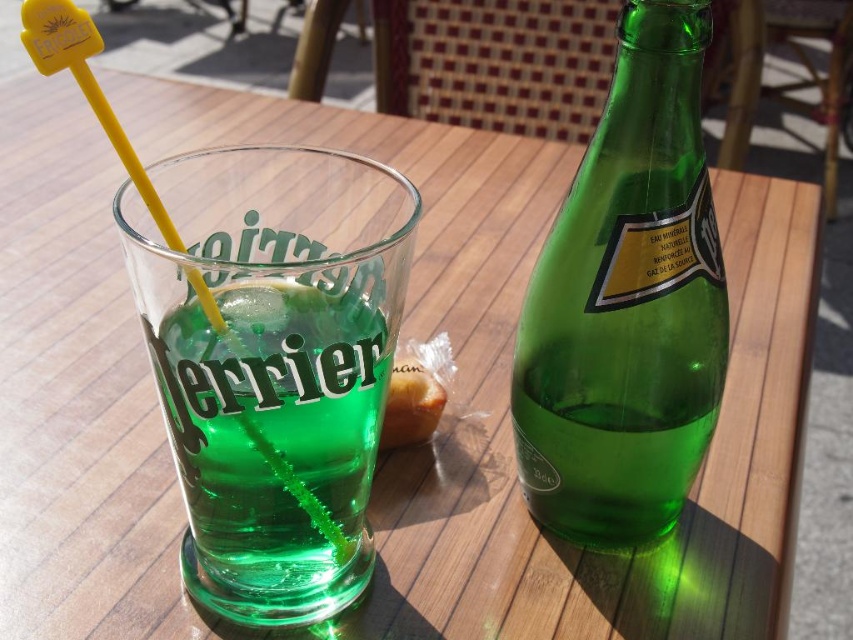
Consider the image. You are at a Perrier table with both the green glass bottle at right and the green glass at center. If you want to pour water from the bottle into the glass, will the glass be able to hold all the water from the bottle?

The green glass bottle at right has a larger size compared to green glass at center, so the glass might not hold all the water from the bottle since the bottle can contain more liquid.

You are sitting at the wooden table in the image. You want to reach for the bread at center without knocking over the green glass at center. Based on their positions, which object should you move first?

The green glass at center is in front of the bread at center, so you should move the green glass at center first to avoid knocking it over when reaching for the bread.